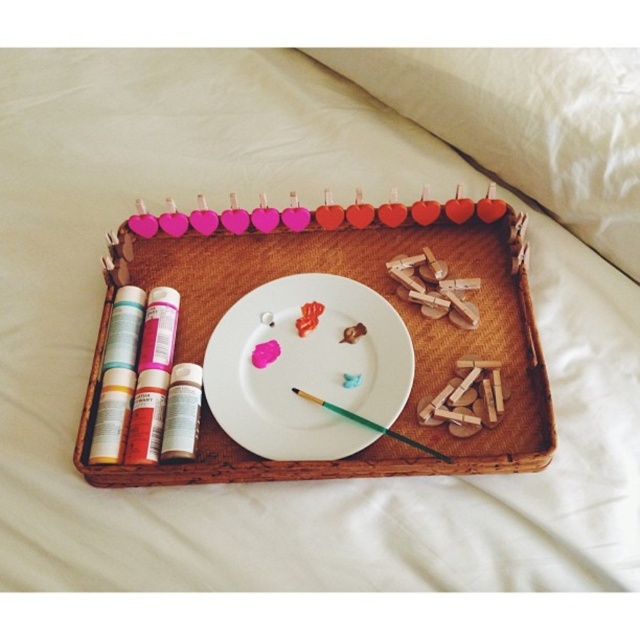
You are organizing a craft station and notice the woven wood tray at center and the white matte paper plate at center. According to their positions, which object is located to the right side of the other?

The woven wood tray at center is to the right of the white matte paper plate at center.

You are an artist working on a craft project and need to reach for the green wood paint brush at center. However, there is a white matte paper plate at center in the way. Can you easily access the brush without moving the plate?

The white matte paper plate at center is further to the viewer than the green wood paint brush at center, meaning the brush is closer to you. Therefore, you can easily access the brush without moving the plate.

You are organizing a craft kit and need to place a new item on the woven tray. The tray has a coordinate system where the bottom left corner is the origin point. The center of the tray is marked at point (x=380, y=292). If you want to place the item exactly at the center of the tray, what coordinates should you use?

The center of the woven wood tray is already marked at point (x=380, y=292), so placing the item at those coordinates will position it exactly at the center of the tray.